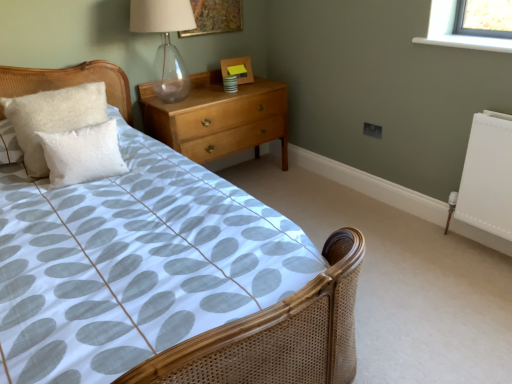
Identify the location of light wood/dark finish chest of drawers at upper center. (218, 117).

The width and height of the screenshot is (512, 384). I want to click on gold textured picture frame at upper center, positioned as the second picture frame in bottom-to-top order, so click(x=215, y=17).

Where is `white fluffy pillow at left, the 1th pillow viewed from the front`? white fluffy pillow at left, the 1th pillow viewed from the front is located at coordinates (82, 154).

How much space does wooden picture frame at upper center, acting as the 1th picture frame starting from the bottom, occupy vertically?

The height of wooden picture frame at upper center, acting as the 1th picture frame starting from the bottom, is 7.56 inches.

The width and height of the screenshot is (512, 384). What do you see at coordinates (238, 69) in the screenshot?
I see `wooden picture frame at upper center, the 2th picture frame viewed from the top` at bounding box center [238, 69].

Identify the location of woven cane bed at center. The image size is (512, 384). (277, 334).

Find the location of a particular element. The height and width of the screenshot is (384, 512). light wood/dark finish chest of drawers at upper center is located at coordinates (218, 117).

From the image's perspective, between white fluffy pillow at left, the 2th pillow in the back-to-front sequence, and woven cane bed at center, which one is located above?

white fluffy pillow at left, the 2th pillow in the back-to-front sequence, appears higher in the image.

In the scene shown: From a real-world perspective, is white fluffy pillow at left, the 1th pillow viewed from the front, on top of woven cane bed at center?

Yes, from a real-world perspective, white fluffy pillow at left, the 1th pillow viewed from the front, is on top of woven cane bed at center.

Is woven cane bed at center surrounded by white fluffy pillow at left, the 1th pillow viewed from the front?

That's incorrect, woven cane bed at center is not inside white fluffy pillow at left, the 1th pillow viewed from the front.

What's the angular difference between white fluffy pillow at left, the 1th pillow viewed from the front, and woven cane bed at center's facing directions?

There is a 2.3-degree angle between the facing directions of white fluffy pillow at left, the 1th pillow viewed from the front, and woven cane bed at center.

Consider the image. Is white fluffy pillow at left, the 1th pillow viewed from the front, not close to wooden picture frame at upper center, the 2th picture frame viewed from the top?

Yes.

From the image's perspective, is white fluffy pillow at left, the 2th pillow in the back-to-front sequence, beneath wooden picture frame at upper center, acting as the 1th picture frame starting from the bottom?

Correct, white fluffy pillow at left, the 2th pillow in the back-to-front sequence, appears lower than wooden picture frame at upper center, acting as the 1th picture frame starting from the bottom, in the image.

Looking at this image, is white fluffy pillow at left, the 1th pillow viewed from the front, positioned beyond the bounds of wooden picture frame at upper center, acting as the 1th picture frame starting from the bottom?

Yes, white fluffy pillow at left, the 1th pillow viewed from the front, is outside of wooden picture frame at upper center, acting as the 1th picture frame starting from the bottom.

The width and height of the screenshot is (512, 384). I want to click on the 2nd picture frame behind when counting from the white fluffy pillow at left, the 2th pillow in the back-to-front sequence, so click(238, 69).

From the image's perspective, is wooden picture frame at upper center, the 2th picture frame viewed from the top, positioned above or below light wood/dark finish chest of drawers at upper center?

wooden picture frame at upper center, the 2th picture frame viewed from the top, is situated higher than light wood/dark finish chest of drawers at upper center in the image.

Which object is positioned more to the left, wooden picture frame at upper center, the 2th picture frame viewed from the top, or light wood/dark finish chest of drawers at upper center?

Positioned to the left is light wood/dark finish chest of drawers at upper center.

Is point (224, 64) positioned before point (199, 95)?

No, (224, 64) is further to viewer.

Considering the sizes of wooden picture frame at upper center, the 2th picture frame viewed from the top, and light wood/dark finish chest of drawers at upper center in the image, is wooden picture frame at upper center, the 2th picture frame viewed from the top, taller or shorter than light wood/dark finish chest of drawers at upper center?

In the image, wooden picture frame at upper center, the 2th picture frame viewed from the top, appears to be shorter than light wood/dark finish chest of drawers at upper center.

Which is closer, [155,358] or [22,139]?

Clearly, point [155,358] is closer to the camera than point [22,139].

Consider the image. Which of these two, woven cane bed at center or white fluffy pillow at upper left, which is the 2th pillow from front to back, stands taller?

woven cane bed at center is taller.

Is woven cane bed at center inside the boundaries of white fluffy pillow at upper left, the 1th pillow viewed from the back, or outside?

woven cane bed at center exists outside the volume of white fluffy pillow at upper left, the 1th pillow viewed from the back.

Is wooden picture frame at upper center, the 2th picture frame viewed from the top, turned away from white fluffy pillow at left, the 2th pillow in the back-to-front sequence?

No, wooden picture frame at upper center, the 2th picture frame viewed from the top,'s orientation is not away from white fluffy pillow at left, the 2th pillow in the back-to-front sequence.

From a real-world perspective, which is physically below, wooden picture frame at upper center, acting as the 1th picture frame starting from the bottom, or white fluffy pillow at left, the 1th pillow viewed from the front?

white fluffy pillow at left, the 1th pillow viewed from the front, is physically lower.

Is wooden picture frame at upper center, the 2th picture frame viewed from the top, located outside white fluffy pillow at left, the 1th pillow viewed from the front?

Yes, wooden picture frame at upper center, the 2th picture frame viewed from the top, is not within white fluffy pillow at left, the 1th pillow viewed from the front.

In terms of width, does wooden picture frame at upper center, the 2th picture frame viewed from the top, look wider or thinner when compared to white fluffy pillow at left, the 2th pillow in the back-to-front sequence?

In the image, wooden picture frame at upper center, the 2th picture frame viewed from the top, appears to be more narrow than white fluffy pillow at left, the 2th pillow in the back-to-front sequence.

Is light wood/dark finish chest of drawers at upper center with white fluffy pillow at upper left, the 1th pillow viewed from the back?

light wood/dark finish chest of drawers at upper center and white fluffy pillow at upper left, the 1th pillow viewed from the back, are clearly separated.

Who is smaller, light wood/dark finish chest of drawers at upper center or white fluffy pillow at upper left, the 1th pillow viewed from the back?

white fluffy pillow at upper left, the 1th pillow viewed from the back, is smaller.

Looking at this image, is light wood/dark finish chest of drawers at upper center to the right of white fluffy pillow at upper left, which is the 2th pillow from front to back, from the viewer's perspective?

Yes.

Locate an element on the screen. chest of drawers on the right of white fluffy pillow at upper left, which is the 2th pillow from front to back is located at coordinates (218, 117).

Between gold textured picture frame at upper center, positioned as the second picture frame in bottom-to-top order, and white fluffy pillow at upper left, which is the 2th pillow from front to back, which one has smaller width?

gold textured picture frame at upper center, positioned as the second picture frame in bottom-to-top order.

From the image's perspective, would you say gold textured picture frame at upper center, positioned as the second picture frame in bottom-to-top order, is positioned over white fluffy pillow at upper left, the 1th pillow viewed from the back?

Yes.

Does gold textured picture frame at upper center, acting as the first picture frame starting from the top, turn towards white fluffy pillow at upper left, which is the 2th pillow from front to back?

No, gold textured picture frame at upper center, acting as the first picture frame starting from the top, is not aimed at white fluffy pillow at upper left, which is the 2th pillow from front to back.

From a real-world perspective, is gold textured picture frame at upper center, acting as the first picture frame starting from the top, above or below white fluffy pillow at upper left, which is the 2th pillow from front to back?

Clearly, from a real-world perspective, gold textured picture frame at upper center, acting as the first picture frame starting from the top, is above white fluffy pillow at upper left, which is the 2th pillow from front to back.

I want to click on pillow that is the 1st object located behind the woven cane bed at center, so click(x=82, y=154).

What are the coordinates of `the 1st picture frame above the white fluffy pillow at left, the 1th pillow viewed from the front (from the image's perspective)` in the screenshot? It's located at (238, 69).

Based on the photo, based on their spatial positions, is transparent glass table lamp at upper center or woven cane bed at center further from light wood/dark finish chest of drawers at upper center?

woven cane bed at center is positioned further to the anchor light wood/dark finish chest of drawers at upper center.

Estimate the real-world distances between objects in this image. Which object is further from transparent glass table lamp at upper center, wooden picture frame at upper center, acting as the 1th picture frame starting from the bottom, or gold textured picture frame at upper center, acting as the first picture frame starting from the top?

Based on the image, wooden picture frame at upper center, acting as the 1th picture frame starting from the bottom, appears to be further to transparent glass table lamp at upper center.

Based on their spatial positions, is transparent glass table lamp at upper center or woven cane bed at center closer to white fluffy pillow at upper left, the 1th pillow viewed from the back?

transparent glass table lamp at upper center is positioned closer to the anchor white fluffy pillow at upper left, the 1th pillow viewed from the back.

Based on their spatial positions, is gold textured picture frame at upper center, positioned as the second picture frame in bottom-to-top order, or woven cane bed at center further from light wood/dark finish chest of drawers at upper center?

The object further to light wood/dark finish chest of drawers at upper center is woven cane bed at center.

Which object lies nearer to the anchor point white fluffy pillow at upper left, the 1th pillow viewed from the back, white fluffy pillow at left, the 1th pillow viewed from the front, or light wood/dark finish chest of drawers at upper center?

Among the two, white fluffy pillow at left, the 1th pillow viewed from the front, is located nearer to white fluffy pillow at upper left, the 1th pillow viewed from the back.

Which object lies further to the anchor point gold textured picture frame at upper center, positioned as the second picture frame in bottom-to-top order, transparent glass table lamp at upper center or light wood/dark finish chest of drawers at upper center?

Among the two, light wood/dark finish chest of drawers at upper center is located further to gold textured picture frame at upper center, positioned as the second picture frame in bottom-to-top order.

Estimate the real-world distances between objects in this image. Which object is closer to wooden picture frame at upper center, the 2th picture frame viewed from the top, transparent glass table lamp at upper center or gold textured picture frame at upper center, positioned as the second picture frame in bottom-to-top order?

gold textured picture frame at upper center, positioned as the second picture frame in bottom-to-top order, is closer to wooden picture frame at upper center, the 2th picture frame viewed from the top.

Considering their positions, is white fluffy pillow at left, the 2th pillow in the back-to-front sequence, positioned further to gold textured picture frame at upper center, positioned as the second picture frame in bottom-to-top order, than white fluffy pillow at upper left, which is the 2th pillow from front to back?

white fluffy pillow at left, the 2th pillow in the back-to-front sequence.

Where is `table lamp that lies between gold textured picture frame at upper center, positioned as the second picture frame in bottom-to-top order, and light wood/dark finish chest of drawers at upper center from top to bottom`? This screenshot has width=512, height=384. table lamp that lies between gold textured picture frame at upper center, positioned as the second picture frame in bottom-to-top order, and light wood/dark finish chest of drawers at upper center from top to bottom is located at coordinates (165, 43).

The width and height of the screenshot is (512, 384). Find the location of `chest of drawers between gold textured picture frame at upper center, acting as the first picture frame starting from the top, and white fluffy pillow at upper left, the 1th pillow viewed from the back, in the vertical direction`. chest of drawers between gold textured picture frame at upper center, acting as the first picture frame starting from the top, and white fluffy pillow at upper left, the 1th pillow viewed from the back, in the vertical direction is located at coordinates (218, 117).

Locate an element on the screen. This screenshot has height=384, width=512. pillow between white fluffy pillow at left, the 2th pillow in the back-to-front sequence, and wooden picture frame at upper center, the 2th picture frame viewed from the top, from front to back is located at coordinates (53, 118).

In order to click on pillow between gold textured picture frame at upper center, acting as the first picture frame starting from the top, and white fluffy pillow at left, the 1th pillow viewed from the front, in the vertical direction in this screenshot , I will do `click(53, 118)`.